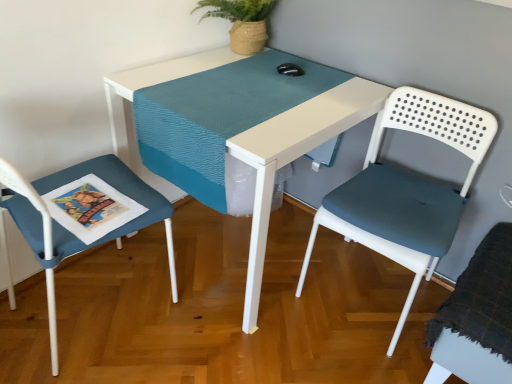
The height and width of the screenshot is (384, 512). What are the coordinates of `vacant space to the right of textured blue cushion at left, which is the third chair from right to left` in the screenshot? It's located at (206, 347).